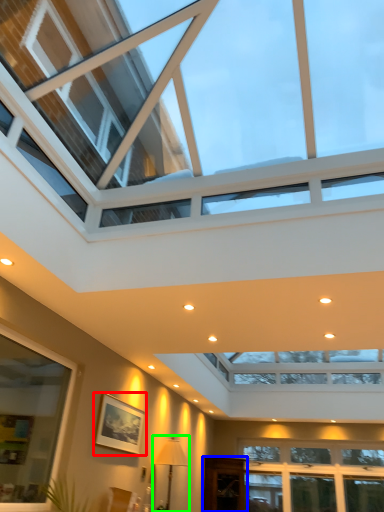
Question: Estimate the real-world distances between objects in this image. Which object is farther from picture frame (highlighted by a red box), glass door (highlighted by a blue box) or lamp (highlighted by a green box)?

Choices:
 (A) glass door
 (B) lamp

Answer: (A)